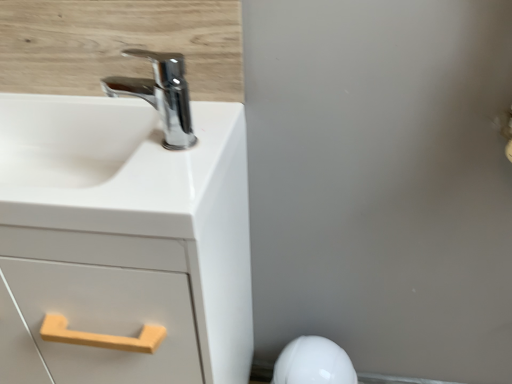
Image resolution: width=512 pixels, height=384 pixels. What do you see at coordinates (115, 165) in the screenshot?
I see `white glossy sink at upper left` at bounding box center [115, 165].

In order to click on chrome/metallic faucet at upper left in this screenshot , I will do `click(160, 95)`.

This screenshot has width=512, height=384. Describe the element at coordinates (124, 237) in the screenshot. I see `white matte cabinet at left` at that location.

Where is `white glossy porcelain at lower right`? This screenshot has height=384, width=512. white glossy porcelain at lower right is located at coordinates (313, 363).

At what (x,y) coordinates should I click in order to perform the action: click on white glossy sink at upper left. Please return your answer as a coordinate pair (x, y). The height and width of the screenshot is (384, 512). Looking at the image, I should click on (115, 165).

From the image's perspective, would you say white glossy porcelain at lower right is shown under white glossy sink at upper left?

Correct, white glossy porcelain at lower right appears lower than white glossy sink at upper left in the image.

In terms of size, does white glossy porcelain at lower right appear bigger or smaller than white glossy sink at upper left?

In the image, white glossy porcelain at lower right appears to be smaller than white glossy sink at upper left.

Is white glossy sink at upper left completely or partially inside white glossy porcelain at lower right?

That's incorrect, white glossy sink at upper left is not inside white glossy porcelain at lower right.

Is white glossy porcelain at lower right not near white glossy sink at upper left?

They are positioned close to each other.

Who is taller, white glossy sink at upper left or white matte cabinet at left?

white matte cabinet at left is taller.

Is white glossy sink at upper left placed right next to white matte cabinet at left?

Indeed, white glossy sink at upper left and white matte cabinet at left are beside each other and touching.

Is white glossy sink at upper left located outside white matte cabinet at left?

No, white glossy sink at upper left is inside or overlapping with white matte cabinet at left.

Is white matte cabinet at left at the back of white glossy sink at upper left?

That's right, white glossy sink at upper left is facing away from white matte cabinet at left.

From the image's perspective, is white matte cabinet at left on white glossy sink at upper left?

No.

Is white matte cabinet at left touching white glossy sink at upper left?

Absolutely, white matte cabinet at left is next to and touching white glossy sink at upper left.

Considering the relative sizes of white matte cabinet at left and white glossy sink at upper left in the image provided, is white matte cabinet at left bigger than white glossy sink at upper left?

Yes, white matte cabinet at left is bigger than white glossy sink at upper left.

Where is `tap behind the white glossy sink at upper left`? tap behind the white glossy sink at upper left is located at coordinates (160, 95).

Between chrome/metallic faucet at upper left and white glossy sink at upper left, which one appears on the right side from the viewer's perspective?

From the viewer's perspective, chrome/metallic faucet at upper left appears more on the right side.

Choose the correct answer: Is chrome/metallic faucet at upper left inside white glossy sink at upper left or outside it?

chrome/metallic faucet at upper left exists outside the volume of white glossy sink at upper left.

Is chrome/metallic faucet at upper left oriented away from white glossy sink at upper left?

chrome/metallic faucet at upper left is not turned away from white glossy sink at upper left.

Based on the photo, can you tell me how much white glossy porcelain at lower right and white matte cabinet at left differ in facing direction?

They differ by 6.29e-05 degrees in their facing directions.

Can you confirm if white glossy porcelain at lower right is positioned to the left of white matte cabinet at left?

In fact, white glossy porcelain at lower right is to the right of white matte cabinet at left.

Considering the sizes of white glossy porcelain at lower right and white matte cabinet at left in the image, is white glossy porcelain at lower right wider or thinner than white matte cabinet at left?

Clearly, white glossy porcelain at lower right has less width compared to white matte cabinet at left.

Where is `porcelain below the white matte cabinet at left (from a real-world perspective)`? The width and height of the screenshot is (512, 384). porcelain below the white matte cabinet at left (from a real-world perspective) is located at coordinates (313, 363).

Who is shorter, white matte cabinet at left or white glossy porcelain at lower right?

With less height is white glossy porcelain at lower right.

Is white matte cabinet at left directly adjacent to white glossy porcelain at lower right?

white matte cabinet at left and white glossy porcelain at lower right are clearly separated.

Is white matte cabinet at left positioned in front of white glossy porcelain at lower right?

Yes, it is.

Which object is wider, white matte cabinet at left or white glossy porcelain at lower right?

white matte cabinet at left.

Is chrome/metallic faucet at upper left aimed at white glossy porcelain at lower right?

No.

Relative to white glossy porcelain at lower right, is chrome/metallic faucet at upper left in front or behind?

chrome/metallic faucet at upper left is in front of white glossy porcelain at lower right.

Which object is positioned more to the left, chrome/metallic faucet at upper left or white glossy porcelain at lower right?

From the viewer's perspective, chrome/metallic faucet at upper left appears more on the left side.

From a real-world perspective, is chrome/metallic faucet at upper left under white glossy porcelain at lower right?

No, from a real-world perspective, chrome/metallic faucet at upper left is not beneath white glossy porcelain at lower right.

This screenshot has width=512, height=384. Find the location of `porcelain that is on the right side of white glossy sink at upper left`. porcelain that is on the right side of white glossy sink at upper left is located at coordinates (313, 363).

I want to click on counter top above the white matte cabinet at left (from the image's perspective), so click(x=115, y=165).

Based on their spatial positions, is white matte cabinet at left or white glossy porcelain at lower right closer to white glossy sink at upper left?

The object closer to white glossy sink at upper left is white matte cabinet at left.

Considering their positions, is white matte cabinet at left positioned closer to white glossy porcelain at lower right than white glossy sink at upper left?

Among the two, white matte cabinet at left is located nearer to white glossy porcelain at lower right.

Based on their spatial positions, is white glossy sink at upper left or chrome/metallic faucet at upper left closer to white glossy porcelain at lower right?

Among the two, white glossy sink at upper left is located nearer to white glossy porcelain at lower right.

From the picture: Considering their positions, is chrome/metallic faucet at upper left positioned further to white glossy sink at upper left than white matte cabinet at left?

Among the two, chrome/metallic faucet at upper left is located further to white glossy sink at upper left.

From the image, which object appears to be farther from white glossy sink at upper left, white glossy porcelain at lower right or chrome/metallic faucet at upper left?

Among the two, white glossy porcelain at lower right is located further to white glossy sink at upper left.

Estimate the real-world distances between objects in this image. Which object is further from white matte cabinet at left, white glossy porcelain at lower right or white glossy sink at upper left?

white glossy porcelain at lower right lies further to white matte cabinet at left than the other object.

From the image, which object appears to be farther from white glossy porcelain at lower right, chrome/metallic faucet at upper left or white glossy sink at upper left?

Based on the image, chrome/metallic faucet at upper left appears to be further to white glossy porcelain at lower right.

Estimate the real-world distances between objects in this image. Which object is further from white glossy sink at upper left, white matte cabinet at left or chrome/metallic faucet at upper left?

Among the two, chrome/metallic faucet at upper left is located further to white glossy sink at upper left.

What are the coordinates of `counter top between chrome/metallic faucet at upper left and white matte cabinet at left vertically` in the screenshot? It's located at (115, 165).

I want to click on counter top between chrome/metallic faucet at upper left and white glossy porcelain at lower right in the vertical direction, so click(115, 165).

In order to click on bathroom cabinet situated between white glossy sink at upper left and white glossy porcelain at lower right from left to right in this screenshot , I will do `click(124, 237)`.

Find the location of a particular element. bathroom cabinet between chrome/metallic faucet at upper left and white glossy porcelain at lower right in the vertical direction is located at coordinates (124, 237).